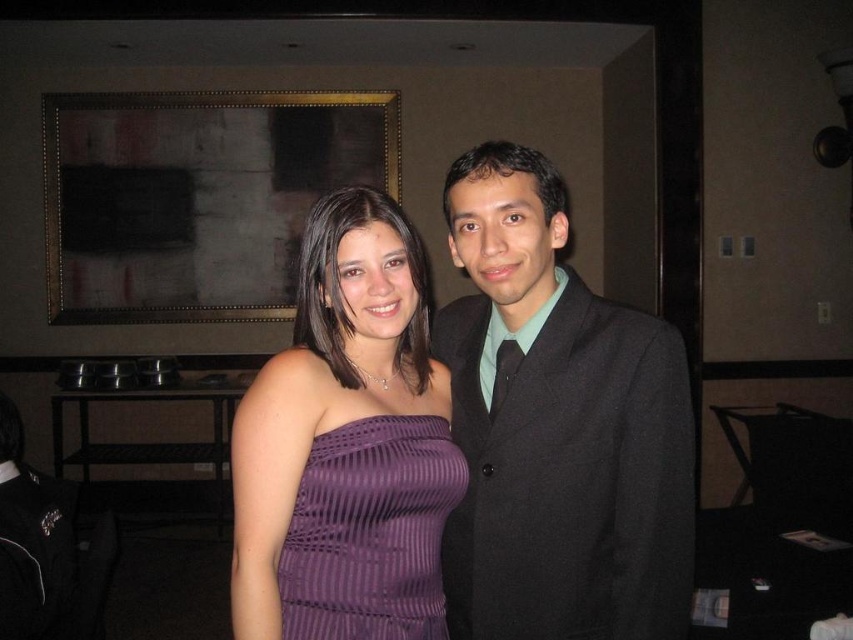
You are a photographer adjusting your camera settings to focus on the matte black suit at center and the dark brown wooden picture frame at upper center. Which object should you focus on first to ensure both are in sharp focus?

You should focus on the matte black suit at center first because it is closer to the camera than the dark brown wooden picture frame at upper center, ensuring both will be in focus when starting with the closer object.

You are a photographer setting up for a formal event. You need to position two dresses in a display case. The display case has two shelves, one above the other. The purple ribbed dress at center and the purple striped dress at center must be placed on these shelves. According to the scene, which dress should go on the upper shelf?

The purple ribbed dress at center should be placed on the upper shelf because it is described as being above the purple striped dress at center in the scene.

You are an interior designer analyzing the spatial layout of the room. Given the coordinates of the purple ribbed dress at center, which is located at point 0.695, 0.407, can you determine if it is positioned closer to the background wall or the foreground of the image?

The coordinates of the purple ribbed dress at center are at point (346, 444). In standard image coordinate systems, the origin is typically at the top left corner, so the y coordinate of 0.407 indicates it is closer to the bottom half of the image. However, without knowing the exact coordinate system orientation or the depth of the room, it is impossible to definitively determine if it is closer to the background wall or the foreground based solely on 2D coordinates.